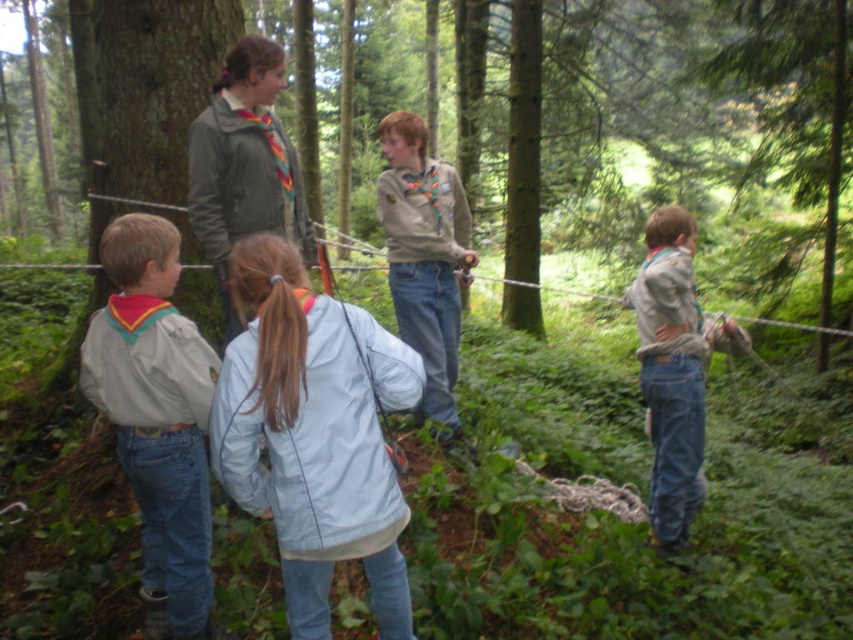
You are a photographer trying to capture a group photo of the children in the forest. You want to ensure the smooth bark tree at left and the light brown uniform at center are both visible. Which object should you focus on first to ensure depth of field? Explain your reasoning based on their sizes.

The smooth bark tree at left is larger in size than the light brown uniform at center. To ensure both are in focus, you should focus on the closer object. However, since the tree is larger, prioritizing focus on the light brown uniform at center might help maintain clarity for the main subject while the tree remains visible in the background.

You are a photographer standing in the forest scene. You want to take a photo that includes both the green matte tree at right and the denim overalls at right. What is the minimum distance you need to move backward to ensure both objects are in frame?

The green matte tree at right and denim overalls at right are 10.10 meters apart. To capture both in the frame, you need to move back at least 10.10 meters to ensure both are visible.

You are a photographer trying to capture a photo of the green matte tree at right and the denim overalls at right. Based on their sizes, which object should you focus on first to ensure both are in frame without moving the camera?

The green matte tree at right is smaller than the denim overalls at right, so you should focus on the denim overalls at right first to ensure both fit in the frame.